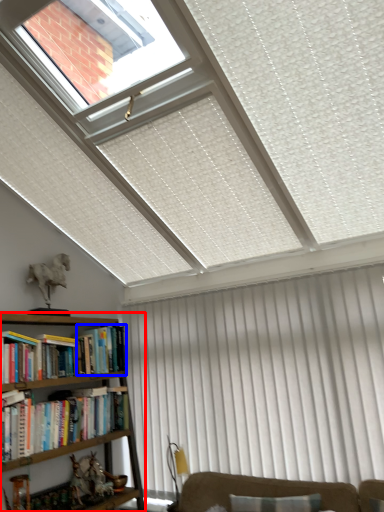
Question: Which object is closer to the camera taking this photo, bookcase (highlighted by a red box) or book (highlighted by a blue box)?

Choices:
 (A) bookcase
 (B) book

Answer: (A)